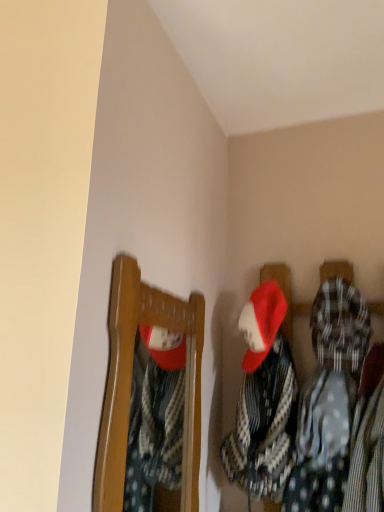
Question: Considering the positions of point (291, 402) and point (135, 287), is point (291, 402) closer or farther from the camera than point (135, 287)?

Choices:
 (A) farther
 (B) closer

Answer: (A)

Question: Considering their positions, is white dotted fabric at center located in front of or behind matte wooden mirror at upper left?

Choices:
 (A) behind
 (B) front

Answer: (A)

Question: Based on their sizes in the image, would you say white dotted fabric at center is bigger or smaller than matte wooden mirror at upper left?

Choices:
 (A) small
 (B) big

Answer: (B)

Question: From their relative heights in the image, would you say matte wooden mirror at upper left is taller or shorter than white dotted fabric at center?

Choices:
 (A) short
 (B) tall

Answer: (B)

Question: Is matte wooden mirror at upper left bigger or smaller than white dotted fabric at center?

Choices:
 (A) big
 (B) small

Answer: (B)

Question: Considering their positions, is matte wooden mirror at upper left located in front of or behind white dotted fabric at center?

Choices:
 (A) front
 (B) behind

Answer: (A)

Question: In the image, is matte wooden mirror at upper left on the left side or the right side of white dotted fabric at center?

Choices:
 (A) left
 (B) right

Answer: (A)